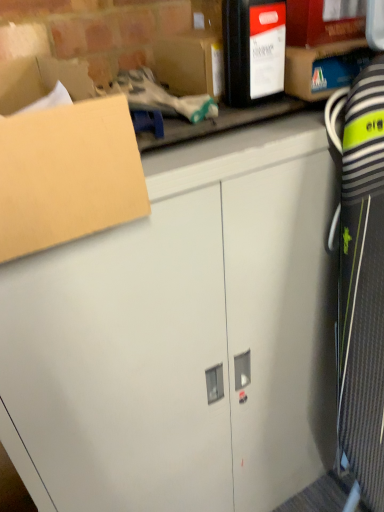
At what (x,y) coordinates should I click in order to perform the action: click on matte cardboard box at upper right, which is counted as the 1th storage box, starting from the right. Please return your answer as a coordinate pair (x, y). Looking at the image, I should click on (318, 25).

Locate an element on the screen. matte black box at upper center, which ranks as the 1th storage box in left-to-right order is located at coordinates (190, 63).

Identify the location of white matte cabinet at center. click(x=184, y=335).

Are white matte cabinet at center and matte black box at upper center, which ranks as the 1th storage box in left-to-right order, far apart?

No, white matte cabinet at center is not far away from matte black box at upper center, which ranks as the 1th storage box in left-to-right order.

Between point (282, 356) and point (184, 61), which one is positioned in front?

Positioned in front is point (184, 61).

Is white matte cabinet at center bigger than matte black box at upper center, placed as the second storage box when sorted from right to left?

Correct, white matte cabinet at center is larger in size than matte black box at upper center, placed as the second storage box when sorted from right to left.

Considering the sizes of objects white matte cabinet at center and matte black box at upper center, which ranks as the 1th storage box in left-to-right order, in the image provided, who is thinner, white matte cabinet at center or matte black box at upper center, which ranks as the 1th storage box in left-to-right order,?

Thinner between the two is matte black box at upper center, which ranks as the 1th storage box in left-to-right order.

Between point (299, 246) and point (120, 208), which one is positioned behind?

The point (299, 246) is more distant.

Is white matte cabinet at center to the left or to the right of brown cardboard box at upper left in the image?

In the image, white matte cabinet at center appears on the right side of brown cardboard box at upper left.

Based on the photo, looking at their sizes, would you say white matte cabinet at center is wider or thinner than brown cardboard box at upper left?

Considering their sizes, white matte cabinet at center looks broader than brown cardboard box at upper left.

Is white matte cabinet at center in front of or behind brown cardboard box at upper left in the image?

white matte cabinet at center is behind brown cardboard box at upper left.

Based on their sizes in the image, would you say brown cardboard box at upper left is bigger or smaller than matte cardboard box at upper right, which is counted as the 1th storage box, starting from the right?

brown cardboard box at upper left is bigger than matte cardboard box at upper right, which is counted as the 1th storage box, starting from the right.

Considering the positions of objects brown cardboard box at upper left and matte cardboard box at upper right, which is counted as the 1th storage box, starting from the right, in the image provided, who is more to the right, brown cardboard box at upper left or matte cardboard box at upper right, which is counted as the 1th storage box, starting from the right,?

From the viewer's perspective, matte cardboard box at upper right, which is counted as the 1th storage box, starting from the right, appears more on the right side.

Can we say brown cardboard box at upper left lies outside matte cardboard box at upper right, the 2th storage box when ordered from left to right?

Indeed, brown cardboard box at upper left is completely outside matte cardboard box at upper right, the 2th storage box when ordered from left to right.

Is brown cardboard box at upper left at the right side of white matte cabinet at center?

In fact, brown cardboard box at upper left is to the left of white matte cabinet at center.

Considering the positions of objects brown cardboard box at upper left and white matte cabinet at center in the image provided, who is in front, brown cardboard box at upper left or white matte cabinet at center?

brown cardboard box at upper left is in front.

Is brown cardboard box at upper left oriented away from white matte cabinet at center?

No, brown cardboard box at upper left's orientation is not away from white matte cabinet at center.

Does point (280, 136) lie behind point (356, 33)?

No, (280, 136) is closer to viewer.

Is white matte cabinet at center completely or partially outside of matte cardboard box at upper right, the 2th storage box when ordered from left to right?

white matte cabinet at center lies outside matte cardboard box at upper right, the 2th storage box when ordered from left to right,'s area.

Who is bigger, white matte cabinet at center or matte cardboard box at upper right, the 2th storage box when ordered from left to right?

With larger size is white matte cabinet at center.

Consider the image. Considering the sizes of objects white matte cabinet at center and matte cardboard box at upper right, which is counted as the 1th storage box, starting from the right, in the image provided, who is thinner, white matte cabinet at center or matte cardboard box at upper right, which is counted as the 1th storage box, starting from the right,?

Thinner between the two is matte cardboard box at upper right, which is counted as the 1th storage box, starting from the right.

Is matte black box at upper center, which ranks as the 1th storage box in left-to-right order, aimed at brown cardboard box at upper left?

No, matte black box at upper center, which ranks as the 1th storage box in left-to-right order, is not aimed at brown cardboard box at upper left.

Could brown cardboard box at upper left be considered to be inside matte black box at upper center, placed as the second storage box when sorted from right to left?

No, matte black box at upper center, placed as the second storage box when sorted from right to left, does not contain brown cardboard box at upper left.

Which is behind, matte black box at upper center, placed as the second storage box when sorted from right to left, or brown cardboard box at upper left?

Positioned behind is matte black box at upper center, placed as the second storage box when sorted from right to left.

From the picture: From a real-world perspective, who is located higher, matte black box at upper center, which ranks as the 1th storage box in left-to-right order, or white matte cabinet at center?

matte black box at upper center, which ranks as the 1th storage box in left-to-right order, is physically above.

Is matte black box at upper center, placed as the second storage box when sorted from right to left, positioned in front of white matte cabinet at center?

That is False.

Is matte black box at upper center, which ranks as the 1th storage box in left-to-right order, bigger than white matte cabinet at center?

No.

Based on the photo, what's the angular difference between matte black box at upper center, which ranks as the 1th storage box in left-to-right order, and white matte cabinet at center's facing directions?

The facing directions of matte black box at upper center, which ranks as the 1th storage box in left-to-right order, and white matte cabinet at center are 10.3 degrees apart.

This screenshot has height=512, width=384. I want to click on storage box lying on the left of white matte cabinet at center, so click(x=190, y=63).

This screenshot has width=384, height=512. Identify the location of cabinetry that is on the right side of brown cardboard box at upper left. (184, 335).

Estimate the real-world distances between objects in this image. Which object is further from matte black box at upper center, which ranks as the 1th storage box in left-to-right order, matte cardboard box at upper right, which is counted as the 1th storage box, starting from the right, or brown cardboard box at upper left?

Among the two, brown cardboard box at upper left is located further to matte black box at upper center, which ranks as the 1th storage box in left-to-right order.

In the scene shown: Based on their spatial positions, is brown cardboard box at upper left or matte cardboard box at upper right, which is counted as the 1th storage box, starting from the right, closer to white matte cabinet at center?

brown cardboard box at upper left.

When comparing their distances from matte black box at upper center, placed as the second storage box when sorted from right to left, does white matte cabinet at center or brown cardboard box at upper left seem closer?

brown cardboard box at upper left lies closer to matte black box at upper center, placed as the second storage box when sorted from right to left, than the other object.

Which object lies nearer to the anchor point matte cardboard box at upper right, which is counted as the 1th storage box, starting from the right, white matte cabinet at center or matte black box at upper center, placed as the second storage box when sorted from right to left?

matte black box at upper center, placed as the second storage box when sorted from right to left, lies closer to matte cardboard box at upper right, which is counted as the 1th storage box, starting from the right, than the other object.

Looking at this image, when comparing their distances from matte cardboard box at upper right, the 2th storage box when ordered from left to right, does brown cardboard box at upper left or matte black box at upper center, which ranks as the 1th storage box in left-to-right order, seem closer?

matte black box at upper center, which ranks as the 1th storage box in left-to-right order, is closer to matte cardboard box at upper right, the 2th storage box when ordered from left to right.

Estimate the real-world distances between objects in this image. Which object is closer to matte cardboard box at upper right, which is counted as the 1th storage box, starting from the right, white matte cabinet at center or brown cardboard box at upper left?

brown cardboard box at upper left is closer to matte cardboard box at upper right, which is counted as the 1th storage box, starting from the right.

Estimate the real-world distances between objects in this image. Which object is further from white matte cabinet at center, matte black box at upper center, placed as the second storage box when sorted from right to left, or brown cardboard box at upper left?

Among the two, matte black box at upper center, placed as the second storage box when sorted from right to left, is located further to white matte cabinet at center.

When comparing their distances from brown cardboard box at upper left, does matte black box at upper center, which ranks as the 1th storage box in left-to-right order, or matte cardboard box at upper right, the 2th storage box when ordered from left to right, seem further?

Based on the image, matte cardboard box at upper right, the 2th storage box when ordered from left to right, appears to be further to brown cardboard box at upper left.

Image resolution: width=384 pixels, height=512 pixels. I want to click on storage box between brown cardboard box at upper left and matte cardboard box at upper right, which is counted as the 1th storage box, starting from the right, from left to right, so click(190, 63).

This screenshot has width=384, height=512. In order to click on storage box between matte cardboard box at upper right, the 2th storage box when ordered from left to right, and white matte cabinet at center in the up-down direction in this screenshot , I will do `click(190, 63)`.

The height and width of the screenshot is (512, 384). I want to click on box between matte black box at upper center, placed as the second storage box when sorted from right to left, and white matte cabinet at center vertically, so click(68, 175).

Where is `box between matte cardboard box at upper right, which is counted as the 1th storage box, starting from the right, and white matte cabinet at center in the up-down direction`? box between matte cardboard box at upper right, which is counted as the 1th storage box, starting from the right, and white matte cabinet at center in the up-down direction is located at coordinates [x=68, y=175].